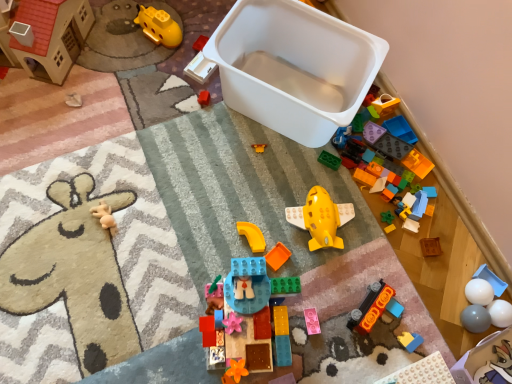
The height and width of the screenshot is (384, 512). I want to click on vacant space behind yellow matte airplane at center, the 8th toy from the left, so point(311,170).